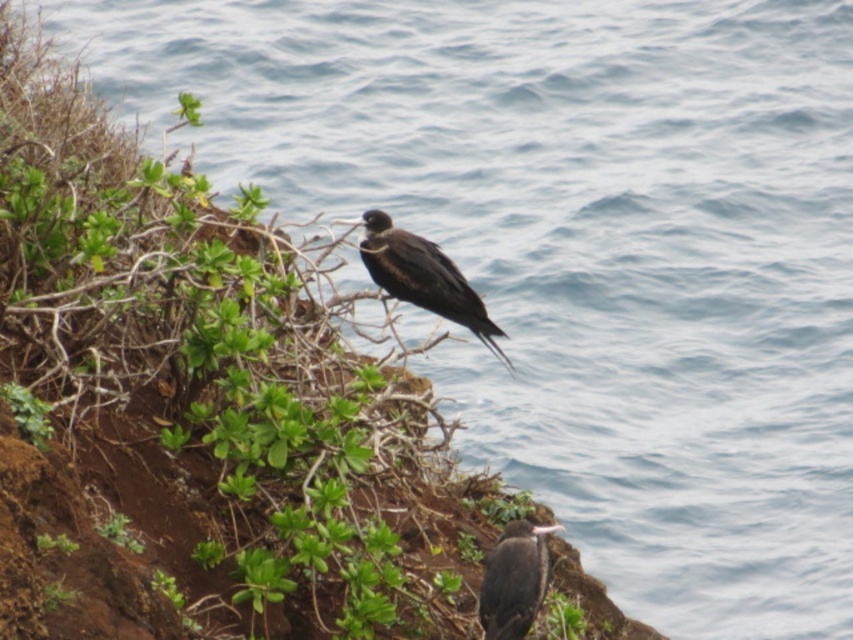
Who is more distant from viewer, (x=370, y=243) or (x=488, y=600)?

Positioned behind is point (x=370, y=243).

Is point (479, 336) behind point (490, 602)?

Yes, point (479, 336) is farther from viewer.

At what (x,y) coordinates should I click in order to perform the action: click on shiny black bird at center. Please return your answer as a coordinate pair (x, y). Image resolution: width=853 pixels, height=640 pixels. Looking at the image, I should click on (422, 276).